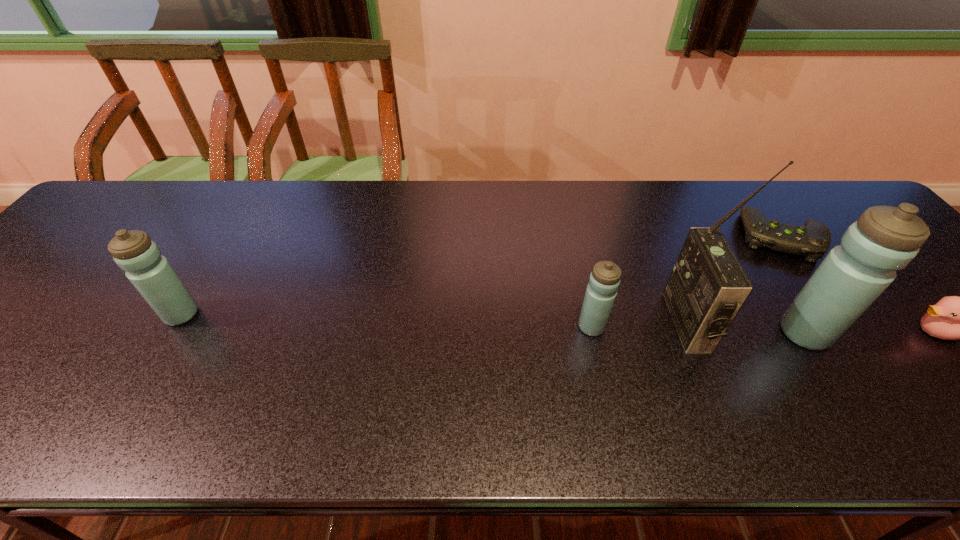
The height and width of the screenshot is (540, 960). I want to click on the leftmost object, so point(152,275).

Identify the location of the fourth shortest object. Image resolution: width=960 pixels, height=540 pixels. (152, 275).

Locate an element on the screen. Image resolution: width=960 pixels, height=540 pixels. the second object from left to right is located at coordinates (604, 281).

Locate an element on the screen. the shortest water bottle is located at coordinates (604, 281).

Locate an element on the screen. This screenshot has height=540, width=960. the rightmost water bottle is located at coordinates [884, 239].

The image size is (960, 540). Identify the location of the second tallest object. [x=884, y=239].

The height and width of the screenshot is (540, 960). Find the location of `the farthest object`. the farthest object is located at coordinates (811, 241).

Where is `control`? The image size is (960, 540). control is located at coordinates (811, 241).

Where is `the fourth object from right to left`? The height and width of the screenshot is (540, 960). the fourth object from right to left is located at coordinates (708, 286).

This screenshot has width=960, height=540. I want to click on the tallest object, so click(x=708, y=286).